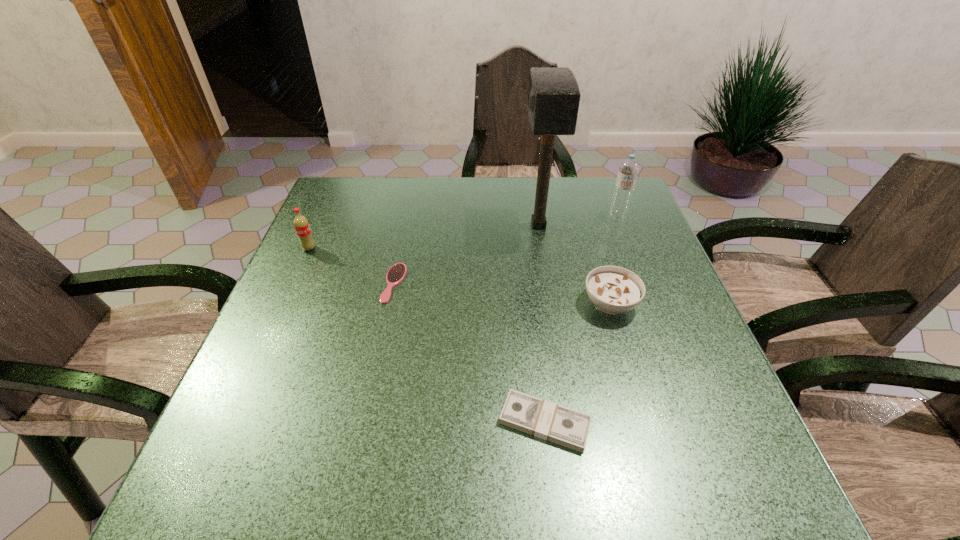
Find the location of `mallet`. mallet is located at coordinates (553, 97).

You are a GUI agent. You are given a task and a screenshot of the screen. Output one action in this format:
    pyautogui.click(x=<x>, y=<y>)
    Task: Click on the second tallest object
    
    Given the screenshot: What is the action you would take?
    pyautogui.click(x=628, y=170)

Identify the location of water bottle. (628, 170).

Find the location of a particular element. soda is located at coordinates (301, 224).

Locate an element on the screen. Image resolution: width=960 pixels, height=540 pixels. the fourth shortest object is located at coordinates (301, 224).

You are a GUI agent. You are given a task and a screenshot of the screen. Output one action in this format:
    pyautogui.click(x=<x>, y=<y>)
    Task: Click on the third shortest object
    
    Given the screenshot: What is the action you would take?
    pyautogui.click(x=614, y=290)

Where is `the fifth object from left to right`? the fifth object from left to right is located at coordinates (614, 290).

The image size is (960, 540). I want to click on the second object from left to right, so click(x=397, y=272).

You are a GUI agent. You are given a task and a screenshot of the screen. Output one action in this format:
    pyautogui.click(x=<x>, y=<y>)
    Task: Click on the dollar
    The height and width of the screenshot is (540, 960).
    Given the screenshot: What is the action you would take?
    pyautogui.click(x=549, y=421)

I want to click on vacant space located on the left of the mallet, so click(480, 225).